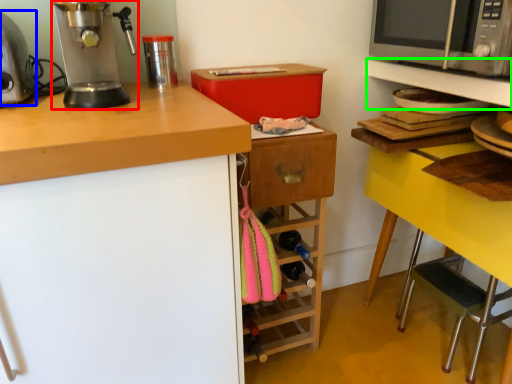
Question: Based on their relative distances, which object is nearer to home appliance (highlighted by a red box)? Choose from kitchen appliance (highlighted by a blue box) and shelf (highlighted by a green box).

Choices:
 (A) kitchen appliance
 (B) shelf

Answer: (A)